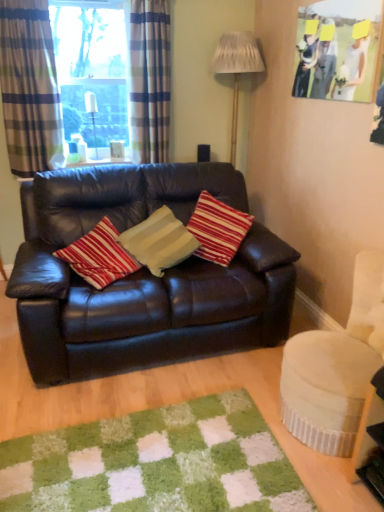
Question: Is striped fabric curtain at left, placed as the second curtain when sorted from right to left, inside the boundaries of clear glass bottle at upper left, which is the second lamp from right to left, or outside?

Choices:
 (A) outside
 (B) inside

Answer: (A)

Question: From their relative heights in the image, would you say striped fabric curtain at left, the 1th curtain viewed from the left, is taller or shorter than clear glass bottle at upper left, marked as the first lamp in a left-to-right arrangement?

Choices:
 (A) tall
 (B) short

Answer: (A)

Question: Estimate the real-world distances between objects in this image. Which object is closer to the matte paper picture frame at upper right?

Choices:
 (A) clear glass bottle at upper left, marked as the first lamp in a left-to-right arrangement
 (B) velvet cream swivel chair at lower right
 (C) shiny brown leather couch at center
 (D) white textured lampshade at upper center, which ranks as the 1th lamp in right-to-left order
 (E) green shaggy mat at lower center

Answer: (D)

Question: Based on their relative distances, which object is farther from the striped fabric curtain at left, placed as the second curtain when sorted from right to left?

Choices:
 (A) shiny brown leather couch at center
 (B) green shaggy mat at lower center
 (C) clear glass window at upper left
 (D) matte paper picture frame at upper right
 (E) velvet cream swivel chair at lower right

Answer: (E)